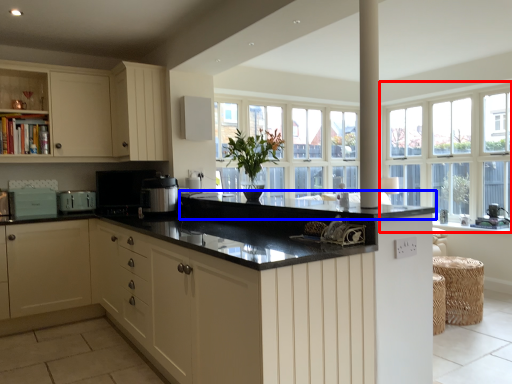
Question: Which point is closer to the camera, window (highlighted by a red box) or countertop (highlighted by a blue box)?

Choices:
 (A) window
 (B) countertop

Answer: (B)